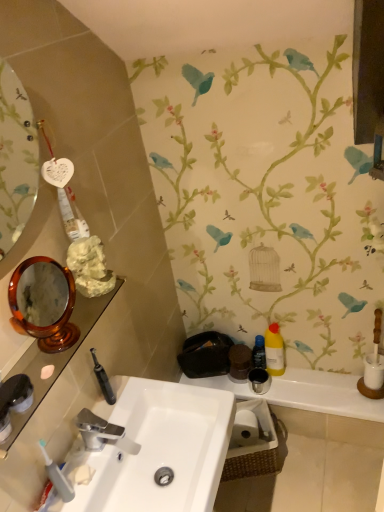
You are a GUI agent. You are given a task and a screenshot of the screen. Output one action in this format:
    pyautogui.click(x=<x>, y=<y>)
    Task: Click on the vacant space in front of yellow matte bottle at right, the 1th mouthwash viewed from the right
    This screenshot has width=384, height=512.
    Given the screenshot: What is the action you would take?
    pyautogui.click(x=300, y=389)